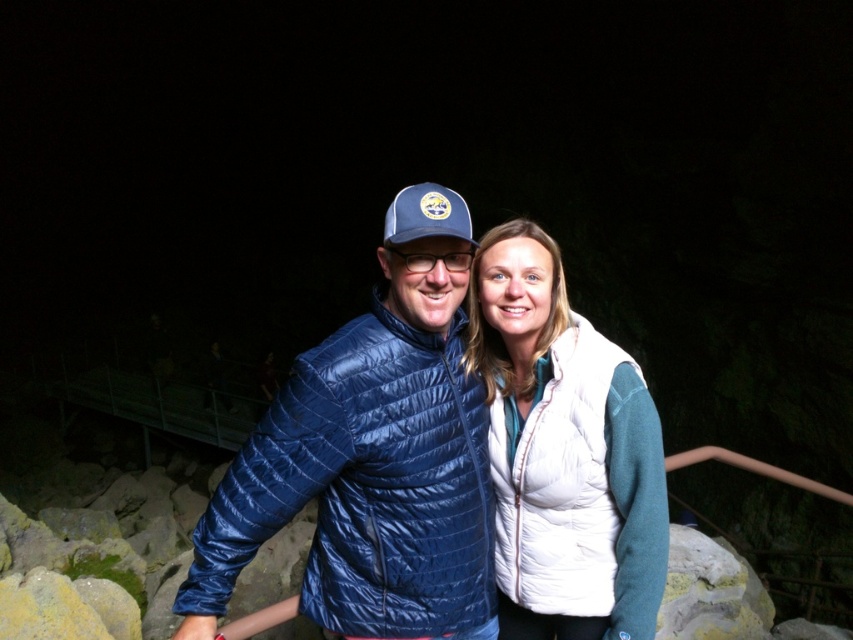
Between matte blue puffer jacket at center and white down vest at center, which one appears on the left side from the viewer's perspective?

matte blue puffer jacket at center

From the picture: Is matte blue puffer jacket at center to the right of white down vest at center from the viewer's perspective?

No, matte blue puffer jacket at center is not to the right of white down vest at center.

You are a GUI agent. You are given a task and a screenshot of the screen. Output one action in this format:
    pyautogui.click(x=<x>, y=<y>)
    Task: Click on the matte blue puffer jacket at center
    This screenshot has width=853, height=640.
    Given the screenshot: What is the action you would take?
    pyautogui.click(x=369, y=470)

Does matte blue puffer jacket at center appear on the left side of blue fabric baseball cap at center?

Indeed, matte blue puffer jacket at center is positioned on the left side of blue fabric baseball cap at center.

At what (x,y) coordinates should I click in order to perform the action: click on matte blue puffer jacket at center. Please return your answer as a coordinate pair (x, y). This screenshot has height=640, width=853. Looking at the image, I should click on (369, 470).

Who is more forward, (549, 264) or (409, 225)?

Positioned in front is point (409, 225).

Between point (531, 408) and point (405, 224), which one is positioned behind?

The point (531, 408) is more distant.

Measure the distance between white down vest at center and camera.

white down vest at center is 1.75 meters away from camera.

Image resolution: width=853 pixels, height=640 pixels. In order to click on white down vest at center in this screenshot , I will do `click(564, 452)`.